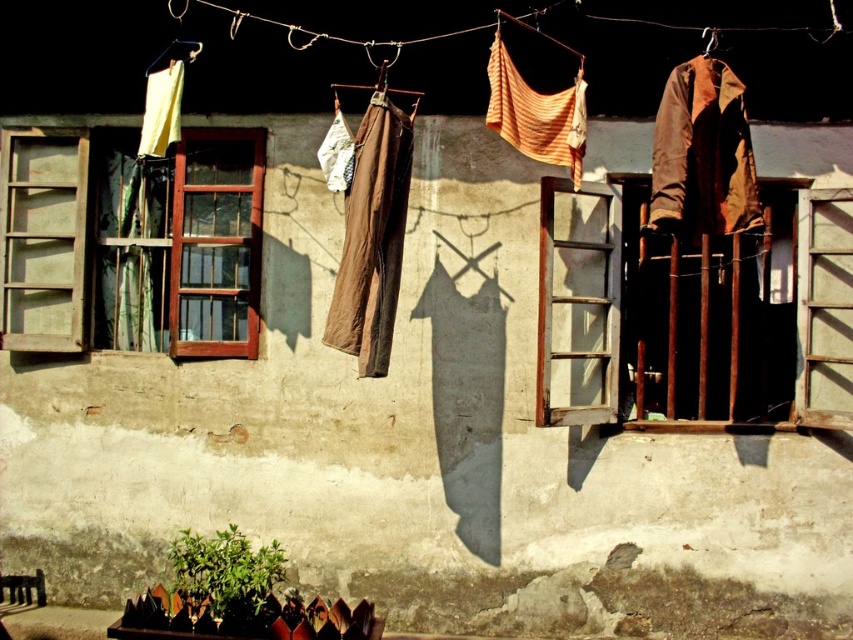
You are standing in front of the weathered wall with clothes hanging above it. There are two points marked on the wall at coordinates point (372,99) and point (712,44). Which point is closer to you?

Point (372,99) is closer to you because it is further to the viewer than point (712,44).

You are a painter standing in front of the weathered wall with two windows. You notice the brown cotton pants at center and the brown fabric at upper right hanging on the clothesline. Which of these two items is larger in size?

The brown cotton pants at center is bigger than brown fabric at upper right.

You are standing in front of the building shown in the image. Where is the brown wooden window at left located in terms of its 2D coordinates?

The brown wooden window at left is located at the 2D coordinates of point (x=183, y=246).